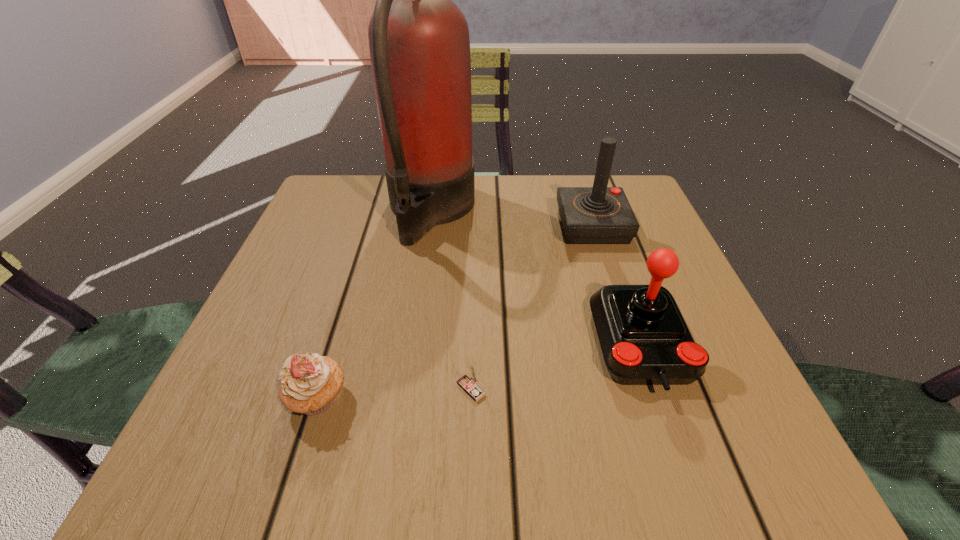
Locate an element on the screen. This screenshot has width=960, height=540. fire extinguisher is located at coordinates (419, 43).

Locate an element on the screen. the farther joystick is located at coordinates (590, 215).

Image resolution: width=960 pixels, height=540 pixels. Find the location of `the nearer joystick`. the nearer joystick is located at coordinates pyautogui.click(x=644, y=339).

Find the location of a particular element. the second shortest object is located at coordinates (309, 385).

Identify the location of matchbox. (468, 383).

Locate an element on the screen. The width and height of the screenshot is (960, 540). vacant position located at the nozzle of the tallest object is located at coordinates (553, 211).

Identify the location of vacant space situated on the rectangular base of the farther joystick. The height and width of the screenshot is (540, 960). (437, 226).

At what (x,y) coordinates should I click in order to perform the action: click on vacant space situated 0.190m on the rectangular base of the farther joystick. Please return your answer as a coordinate pair (x, y). Image resolution: width=960 pixels, height=540 pixels. Looking at the image, I should click on (472, 226).

Identify the location of free space located on the rectangular base of the farther joystick. The image size is (960, 540). (400, 226).

Image resolution: width=960 pixels, height=540 pixels. What are the coordinates of `blank space located 0.110m on the base of the nearer joystick` in the screenshot? It's located at (687, 477).